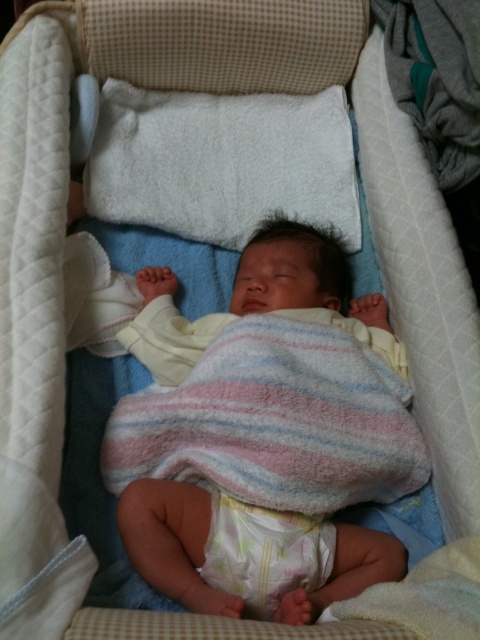
Based on the photo, is soft cotton blanket at center further to the viewer compared to white soft diaper at center?

No.

Is point (379, 380) more distant than point (241, 515)?

Yes, it is.

Between point (356, 493) and point (330, 548), which one is positioned in front?

Point (330, 548)

Find the location of a particular element. This screenshot has width=480, height=640. soft cotton blanket at center is located at coordinates (267, 440).